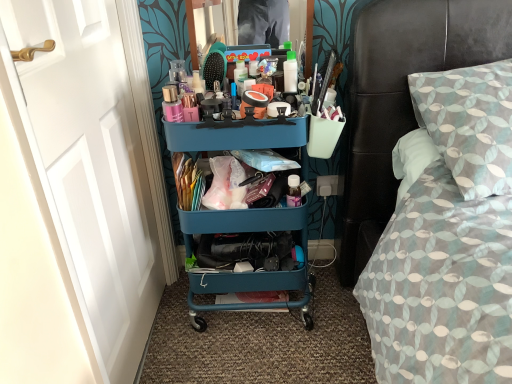
Measure the distance between teal plastic cart at center and camera.

1.16 meters.

The image size is (512, 384). In order to click on white plastic power outlet at lower center in this screenshot , I will do `click(327, 185)`.

Considering the sizes of patterned fabric bed at right and white plastic power outlet at lower center in the image, is patterned fabric bed at right taller or shorter than white plastic power outlet at lower center?

In the image, patterned fabric bed at right appears to be taller than white plastic power outlet at lower center.

How many degrees apart are the facing directions of patterned fabric bed at right and white plastic power outlet at lower center?

They differ by 1.77 degrees in their facing directions.

From a real-world perspective, which is physically above, patterned fabric bed at right or white plastic power outlet at lower center?

In real-world perspective, patterned fabric bed at right is above.

From the image's perspective, relative to white plastic power outlet at lower center, is patterned fabric bed at right above or below?

patterned fabric bed at right is situated higher than white plastic power outlet at lower center in the image.

Does white painted wood door at left contain teal plastic cart at center?

No.

Is white painted wood door at left turned away from teal plastic cart at center?

white painted wood door at left is not turned away from teal plastic cart at center.

Between white painted wood door at left and teal plastic cart at center, which one has less height?

teal plastic cart at center is shorter.

Does white painted wood door at left touch teal plastic cart at center?

No, white painted wood door at left is not next to teal plastic cart at center.

In terms of size, does patterned fabric bed at right appear bigger or smaller than white painted wood door at left?

patterned fabric bed at right is bigger than white painted wood door at left.

Between point (421, 361) and point (7, 15), which one is positioned in front?

Point (7, 15)

Is patterned fabric bed at right far from white painted wood door at left?

patterned fabric bed at right is actually quite close to white painted wood door at left.

Looking at this image, from the image's perspective, is patterned fabric bed at right located above or below white painted wood door at left?

Clearly, from the image's perspective, patterned fabric bed at right is above white painted wood door at left.

This screenshot has width=512, height=384. What are the coordinates of `shelf below the white plastic power outlet at lower center (from the image's perspective)` in the screenshot? It's located at (234, 136).

Is teal plastic cart at center facing away from white plastic power outlet at lower center?

teal plastic cart at center is not turned away from white plastic power outlet at lower center.

Does teal plastic cart at center have a greater height compared to white plastic power outlet at lower center?

Yes, teal plastic cart at center is taller than white plastic power outlet at lower center.

Would you say teal plastic cart at center is to the left or to the right of white plastic power outlet at lower center in the picture?

teal plastic cart at center is positioned on white plastic power outlet at lower center's left side.

Looking at this image, from the image's perspective, which one is positioned lower, white plastic power outlet at lower center or teal plastic cart at center?

teal plastic cart at center is shown below in the image.

Does white plastic power outlet at lower center turn towards teal plastic cart at center?

No, white plastic power outlet at lower center is not oriented towards teal plastic cart at center.

Which object is more forward, white plastic power outlet at lower center or teal plastic cart at center?

teal plastic cart at center is in front.

Between point (327, 187) and point (190, 242), which one is positioned in front?

The point (190, 242) is closer to the camera.

Does white plastic power outlet at lower center appear on the left side of white painted wood door at left?

In fact, white plastic power outlet at lower center is to the right of white painted wood door at left.

Is the surface of white plastic power outlet at lower center in direct contact with white painted wood door at left?

No, white plastic power outlet at lower center is not making contact with white painted wood door at left.

Which object is wider, white plastic power outlet at lower center or white painted wood door at left?

With larger width is white painted wood door at left.

Is white painted wood door at left facing away from patterned fabric bed at right?

No, white painted wood door at left's orientation is not away from patterned fabric bed at right.

How distant is white painted wood door at left from patterned fabric bed at right?

white painted wood door at left and patterned fabric bed at right are 31.57 inches apart.

In the image, there is a patterned fabric bed at right. Where is `door below it (from the image's perspective)`? The height and width of the screenshot is (384, 512). door below it (from the image's perspective) is located at coordinates (97, 163).

Is white painted wood door at left in contact with patterned fabric bed at right?

white painted wood door at left is not next to patterned fabric bed at right, and they're not touching.

This screenshot has width=512, height=384. I want to click on bed on the right of white plastic power outlet at lower center, so click(448, 238).

Where is `shelf below the white painted wood door at left (from a real-world perspective)`? Image resolution: width=512 pixels, height=384 pixels. shelf below the white painted wood door at left (from a real-world perspective) is located at coordinates (234, 136).

Estimate the real-world distances between objects in this image. Which object is closer to teal plastic cart at center, white painted wood door at left or patterned fabric bed at right?

The object closer to teal plastic cart at center is white painted wood door at left.

Based on their spatial positions, is patterned fabric bed at right or teal plastic cart at center further from white plastic power outlet at lower center?

Based on the image, patterned fabric bed at right appears to be further to white plastic power outlet at lower center.

Considering their positions, is patterned fabric bed at right positioned closer to white painted wood door at left than teal plastic cart at center?

teal plastic cart at center lies closer to white painted wood door at left than the other object.

When comparing their distances from white painted wood door at left, does teal plastic cart at center or patterned fabric bed at right seem further?

Based on the image, patterned fabric bed at right appears to be further to white painted wood door at left.

Consider the image. When comparing their distances from patterned fabric bed at right, does white plastic power outlet at lower center or white painted wood door at left seem closer?

white plastic power outlet at lower center is closer to patterned fabric bed at right.

Considering their positions, is white plastic power outlet at lower center positioned further to patterned fabric bed at right than teal plastic cart at center?

white plastic power outlet at lower center lies further to patterned fabric bed at right than the other object.

Consider the image. Based on their spatial positions, is patterned fabric bed at right or white painted wood door at left further from teal plastic cart at center?

patterned fabric bed at right is further to teal plastic cart at center.

Consider the image. Based on their spatial positions, is white painted wood door at left or teal plastic cart at center further from white plastic power outlet at lower center?

white painted wood door at left lies further to white plastic power outlet at lower center than the other object.

You are a GUI agent. You are given a task and a screenshot of the screen. Output one action in this format:
    pyautogui.click(x=<x>, y=<y>)
    Task: Click on the shelf between white painted wood door at left and patterned fabric bed at right in the horizontal direction
    Image resolution: width=512 pixels, height=384 pixels.
    Given the screenshot: What is the action you would take?
    pyautogui.click(x=234, y=136)

I want to click on shelf between white painted wood door at left and white plastic power outlet at lower center from front to back, so click(234, 136).

Find the location of a particular element. bed positioned between white painted wood door at left and white plastic power outlet at lower center from near to far is located at coordinates (448, 238).

Image resolution: width=512 pixels, height=384 pixels. Identify the location of shelf between patterned fabric bed at right and white plastic power outlet at lower center from front to back. (234, 136).